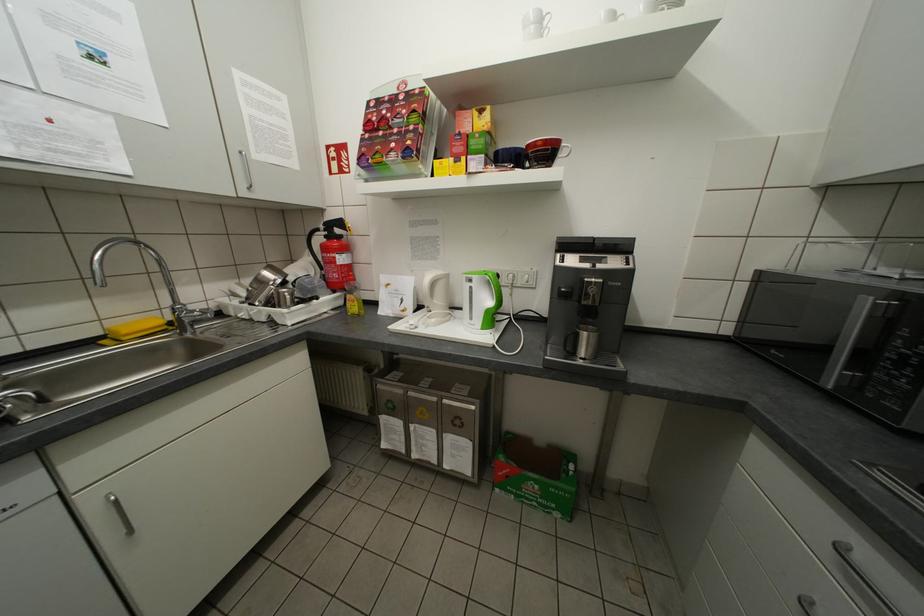
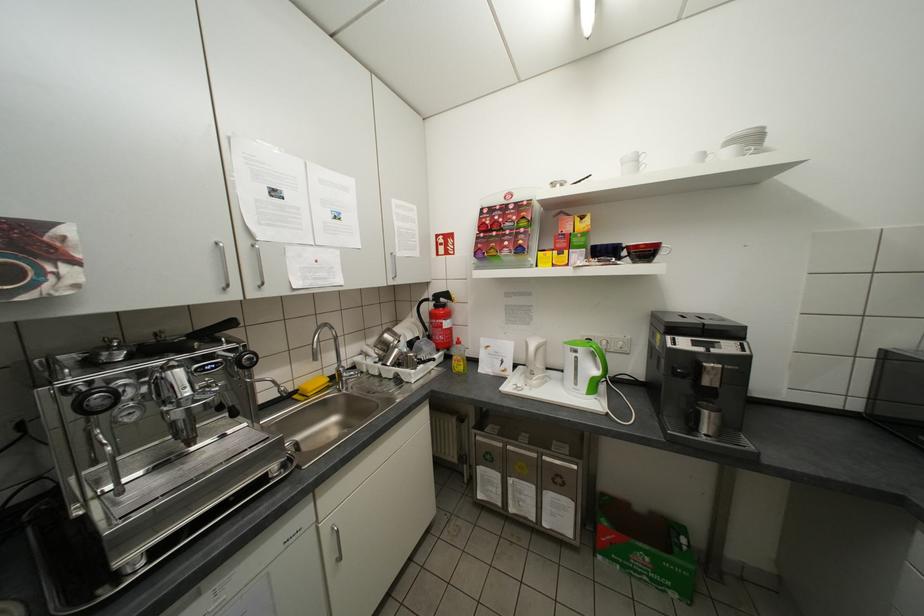
Locate, in the second image, the point that corresponds to pixel 480 305 in the first image.

(585, 373)